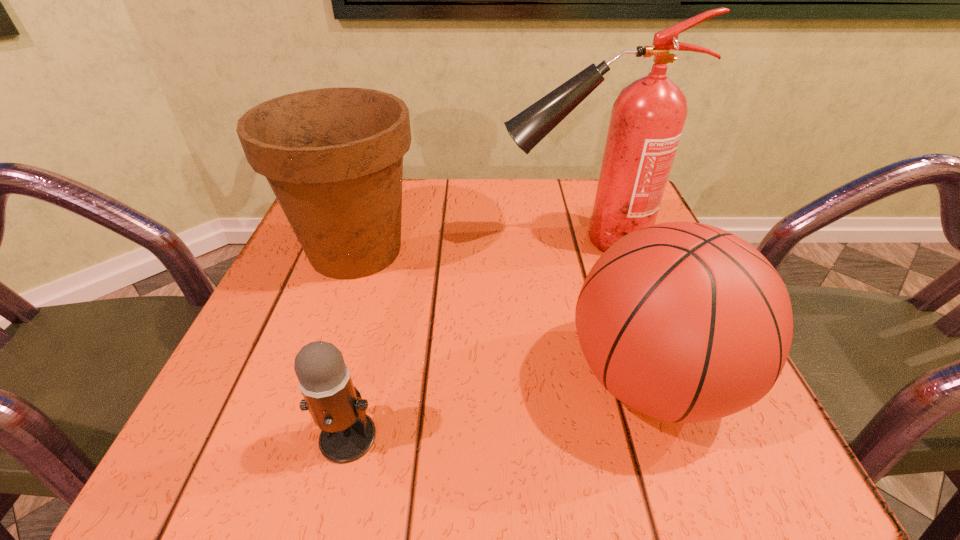
Locate an element on the screen. The image size is (960, 540). fire extinguisher is located at coordinates (648, 116).

Where is `flowerpot`? The image size is (960, 540). flowerpot is located at coordinates (333, 157).

Find the location of a particular element. basketball is located at coordinates (685, 322).

The height and width of the screenshot is (540, 960). Find the location of `microphone`. microphone is located at coordinates (337, 408).

The image size is (960, 540). What are the coordinates of `free space located 0.350m at the nozzle end of the fire extinguisher` in the screenshot? It's located at (325, 241).

The width and height of the screenshot is (960, 540). I want to click on free space located 0.240m at the nozzle end of the fire extinguisher, so click(380, 241).

At what (x,y) coordinates should I click in order to perform the action: click on free location located at the nozzle end of the fire extinguisher. Please return your answer as a coordinate pair (x, y). Looking at the image, I should click on (465, 241).

Find the location of a particular element. vacant region located 0.270m on the front of the flowerpot is located at coordinates (290, 441).

The width and height of the screenshot is (960, 540). I want to click on vacant region located 0.360m on the left of the basketball, so click(316, 380).

At what (x,y) coordinates should I click in order to perform the action: click on vacant position located 0.160m on the left of the shortest object. Please return your answer as a coordinate pair (x, y). The height and width of the screenshot is (540, 960). Looking at the image, I should click on (194, 436).